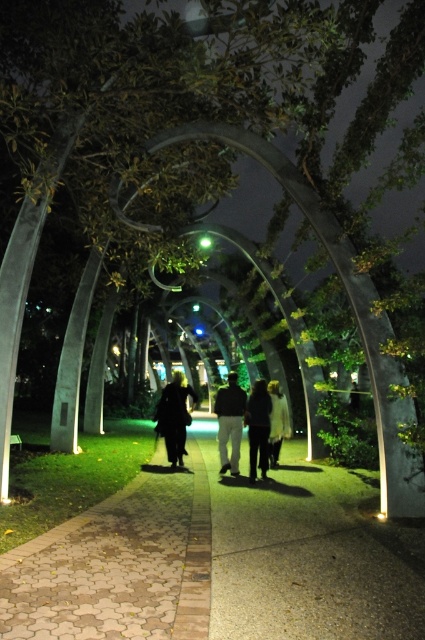
Which of these two, brown cobblestone pavement at center or black matte coat at center, stands shorter?

Standing shorter between the two is brown cobblestone pavement at center.

Is brown cobblestone pavement at center positioned at the back of black matte coat at center?

No, it is not.

The width and height of the screenshot is (425, 640). In order to click on brown cobblestone pavement at center in this screenshot , I will do `click(119, 563)`.

Between dark gray fabric pants at center and dark fabric pants at center, which one appears on the right side from the viewer's perspective?

From the viewer's perspective, dark fabric pants at center appears more on the right side.

Does dark gray fabric pants at center have a larger size compared to dark fabric pants at center?

Actually, dark gray fabric pants at center might be smaller than dark fabric pants at center.

Which is in front, point (235, 444) or point (258, 396)?

Point (258, 396) is in front.

This screenshot has height=640, width=425. In order to click on dark gray fabric pants at center in this screenshot , I will do `click(229, 422)`.

Is brown cobblestone pavement at center above dark fabric pants at center?

Incorrect, brown cobblestone pavement at center is not positioned above dark fabric pants at center.

Based on the photo, can you confirm if brown cobblestone pavement at center is wider than dark fabric pants at center?

Yes.

The image size is (425, 640). Identify the location of brown cobblestone pavement at center. (119, 563).

You are a GUI agent. You are given a task and a screenshot of the screen. Output one action in this format:
    pyautogui.click(x=<x>, y=<y>)
    Task: Click on the brown cobblestone pavement at center
    
    Given the screenshot: What is the action you would take?
    pyautogui.click(x=119, y=563)